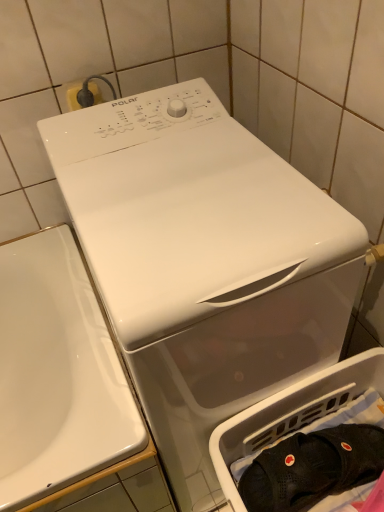
Question: Is black mesh bag at lower right located within black mesh socks at lower right?

Choices:
 (A) yes
 (B) no

Answer: (B)

Question: Considering the relative sizes of black mesh socks at lower right and black mesh bag at lower right in the image provided, is black mesh socks at lower right shorter than black mesh bag at lower right?

Choices:
 (A) no
 (B) yes

Answer: (B)

Question: Can you confirm if black mesh socks at lower right is wider than black mesh bag at lower right?

Choices:
 (A) yes
 (B) no

Answer: (B)

Question: Does black mesh socks at lower right have a greater height compared to black mesh bag at lower right?

Choices:
 (A) no
 (B) yes

Answer: (A)

Question: Does black mesh socks at lower right appear on the left side of black mesh bag at lower right?

Choices:
 (A) yes
 (B) no

Answer: (A)

Question: Is black mesh socks at lower right at the right side of black mesh bag at lower right?

Choices:
 (A) no
 (B) yes

Answer: (A)

Question: From a real-world perspective, is black mesh socks at lower right over white glossy washing machine at center?

Choices:
 (A) no
 (B) yes

Answer: (A)

Question: Is black mesh socks at lower right thinner than white glossy washing machine at center?

Choices:
 (A) yes
 (B) no

Answer: (A)

Question: Is black mesh socks at lower right positioned before white glossy washing machine at center?

Choices:
 (A) no
 (B) yes

Answer: (A)

Question: Considering the relative positions of black mesh socks at lower right and white glossy washing machine at center in the image provided, is black mesh socks at lower right behind white glossy washing machine at center?

Choices:
 (A) no
 (B) yes

Answer: (B)

Question: From the image's perspective, does black mesh socks at lower right appear lower than white glossy washing machine at center?

Choices:
 (A) no
 (B) yes

Answer: (B)

Question: Is black mesh socks at lower right taller than white glossy washing machine at center?

Choices:
 (A) yes
 (B) no

Answer: (B)

Question: Is black mesh bag at lower right looking in the opposite direction of black mesh socks at lower right?

Choices:
 (A) no
 (B) yes

Answer: (B)